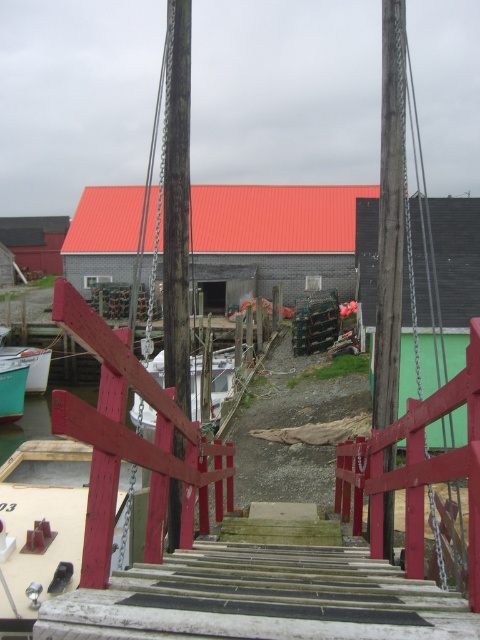
Is wooden post at center to the left of green matte boat at lower left from the viewer's perspective?

In fact, wooden post at center is to the right of green matte boat at lower left.

Can you confirm if wooden post at center is shorter than green matte boat at lower left?

In fact, wooden post at center may be taller than green matte boat at lower left.

Where is `wooden post at center`? Image resolution: width=480 pixels, height=640 pixels. wooden post at center is located at coordinates (177, 202).

Can you confirm if smooth wooden post at center is shorter than green matte boat at lower left?

In fact, smooth wooden post at center may be taller than green matte boat at lower left.

Between smooth wooden post at center and green matte boat at lower left, which one is positioned lower?

green matte boat at lower left

Is point (385, 451) farther from camera compared to point (11, 349)?

No.

Locate an element on the screen. Image resolution: width=480 pixels, height=640 pixels. smooth wooden post at center is located at coordinates (389, 218).

Is smooth wooden post at center to the left of wooden post at center from the viewer's perspective?

In fact, smooth wooden post at center is to the right of wooden post at center.

Can you confirm if smooth wooden post at center is smaller than wooden post at center?

Yes.

This screenshot has width=480, height=640. In order to click on smooth wooden post at center in this screenshot , I will do `click(389, 218)`.